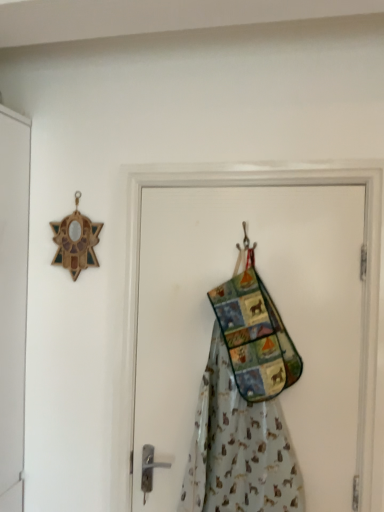
Find the location of a particular element. This screenshot has width=384, height=512. textured fabric apron at center is located at coordinates (238, 448).

The height and width of the screenshot is (512, 384). In order to click on textured fabric apron at center in this screenshot , I will do `click(238, 448)`.

Is metallic hook at center wider or thinner than fabric patchwork bag at center?

Clearly, metallic hook at center has less width compared to fabric patchwork bag at center.

Which of these two, metallic hook at center or fabric patchwork bag at center, stands shorter?

metallic hook at center is shorter.

Considering the sizes of objects metallic hook at center and fabric patchwork bag at center in the image provided, who is bigger, metallic hook at center or fabric patchwork bag at center?

With larger size is fabric patchwork bag at center.

Does metallic hook at center turn towards fabric patchwork bag at center?

Yes, metallic hook at center is oriented towards fabric patchwork bag at center.

Is textured fabric apron at center positioned behind metallic hook at center?

No, the depth of textured fabric apron at center is less than that of metallic hook at center.

Considering the sizes of textured fabric apron at center and metallic hook at center in the image, is textured fabric apron at center taller or shorter than metallic hook at center?

In the image, textured fabric apron at center appears to be taller than metallic hook at center.

Can metallic hook at center be found inside textured fabric apron at center?

Yes, metallic hook at center is surrounded by textured fabric apron at center.

Which point is more forward, (246, 464) or (247, 245)?

The point (246, 464) is closer.

In the image, is metallic hook at center on the left side or the right side of textured fabric apron at center?

metallic hook at center is to the right of textured fabric apron at center.

Considering the sizes of objects metallic hook at center and textured fabric apron at center in the image provided, who is taller, metallic hook at center or textured fabric apron at center?

textured fabric apron at center is taller.

Could you tell me if metallic hook at center is facing textured fabric apron at center?

No, metallic hook at center is not facing towards textured fabric apron at center.

Is the surface of metallic hook at center in direct contact with textured fabric apron at center?

No, metallic hook at center is not making contact with textured fabric apron at center.

Is point (347, 290) closer to viewer compared to point (244, 236)?

Yes, it is.

Based on the photo, between fabric patchwork bag at center and metallic hook at center, which one has less height?

Standing shorter between the two is metallic hook at center.

Is metallic hook at center a part of fabric patchwork bag at center?

Yes, fabric patchwork bag at center is surrounding metallic hook at center.

At what (x,y) coordinates should I click in order to perform the action: click on hanger above the fabric patchwork bag at center (from the image's perspective). Please return your answer as a coordinate pair (x, y). Looking at the image, I should click on (245, 253).

From the image's perspective, is fabric patchwork bag at center below textured fabric apron at center?

No.

Considering the positions of objects fabric patchwork bag at center and textured fabric apron at center in the image provided, who is more to the left, fabric patchwork bag at center or textured fabric apron at center?

Positioned to the left is textured fabric apron at center.

Is fabric patchwork bag at center not near textured fabric apron at center?

No, there isn't a large distance between fabric patchwork bag at center and textured fabric apron at center.

Is fabric patchwork bag at center aimed at textured fabric apron at center?

Yes, fabric patchwork bag at center is facing textured fabric apron at center.

Based on the photo, from a real-world perspective, is textured fabric apron at center located beneath fabric patchwork bag at center?

Indeed, from a real-world perspective, textured fabric apron at center is positioned beneath fabric patchwork bag at center.

Considering the positions of objects textured fabric apron at center and fabric patchwork bag at center in the image provided, who is in front, textured fabric apron at center or fabric patchwork bag at center?

textured fabric apron at center is in front.

Where is `door above the textured fabric apron at center (from a real-world perspective)`? The width and height of the screenshot is (384, 512). door above the textured fabric apron at center (from a real-world perspective) is located at coordinates (228, 357).

In terms of size, does textured fabric apron at center appear bigger or smaller than fabric patchwork bag at center?

Clearly, textured fabric apron at center is larger in size than fabric patchwork bag at center.

The height and width of the screenshot is (512, 384). Find the location of `hanger above the fabric patchwork bag at center (from a real-world perspective)`. hanger above the fabric patchwork bag at center (from a real-world perspective) is located at coordinates (245, 253).

The height and width of the screenshot is (512, 384). I want to click on hanger behind the textured fabric apron at center, so click(x=245, y=253).

Estimate the real-world distances between objects in this image. Which object is further from fabric patchwork bag at center, metallic hook at center or textured fabric apron at center?

metallic hook at center is further to fabric patchwork bag at center.

Based on the photo, looking at the image, which one is located closer to textured fabric apron at center, metallic hook at center or fabric patchwork bag at center?

Based on the image, fabric patchwork bag at center appears to be nearer to textured fabric apron at center.

Looking at the image, which one is located closer to metallic hook at center, fabric patchwork bag at center or textured fabric apron at center?

Based on the image, fabric patchwork bag at center appears to be nearer to metallic hook at center.

Which object lies nearer to the anchor point fabric patchwork bag at center, textured fabric apron at center or metallic hook at center?

textured fabric apron at center is closer to fabric patchwork bag at center.

Looking at the image, which one is located closer to metallic hook at center, textured fabric apron at center or fabric patchwork bag at center?

fabric patchwork bag at center lies closer to metallic hook at center than the other object.

From the image, which object appears to be nearer to textured fabric apron at center, fabric patchwork bag at center or metallic hook at center?

fabric patchwork bag at center.

Find the location of a particular element. door between metallic hook at center and textured fabric apron at center vertically is located at coordinates (228, 357).